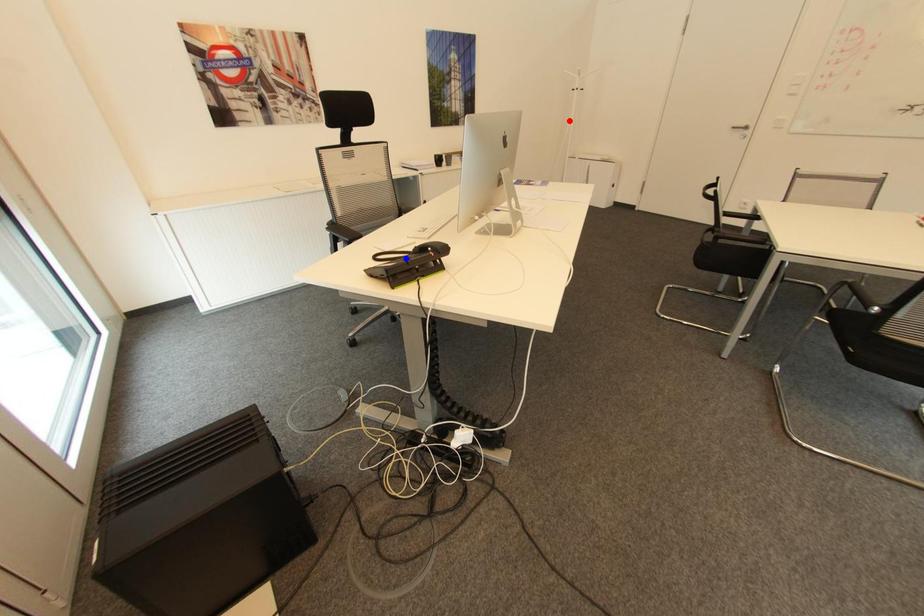
Question: Two points are marked on the image. Which point is closer to the camera?

Choices:
 (A) Blue point is closer.
 (B) Red point is closer.

Answer: (A)